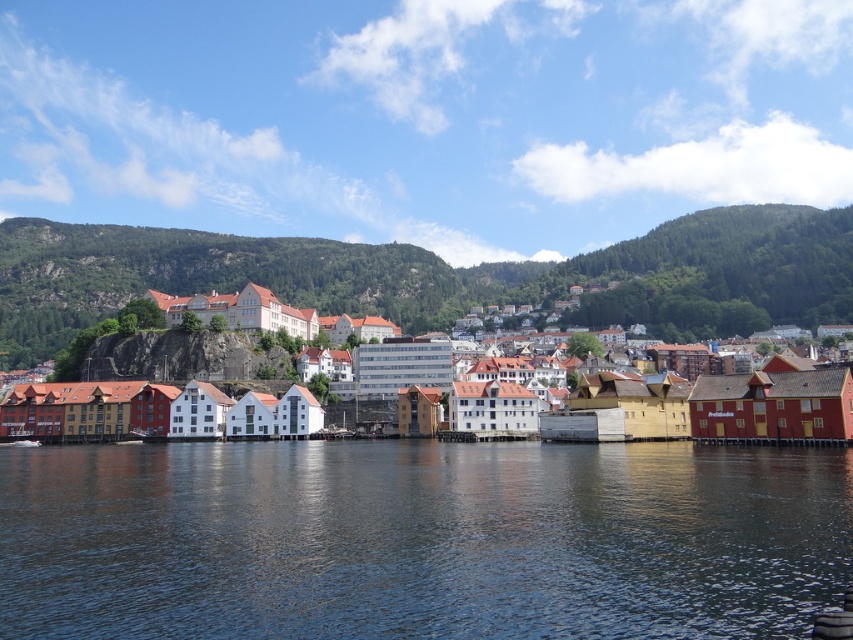
You are standing at the waterfront and looking towards the green forested mountain at upper center. Which direction should you walk to get closer to the transparent water at center?

You should walk forward towards the transparent water at center because it is located below the green forested mountain at upper center, meaning it is closer to your current position at the waterfront.